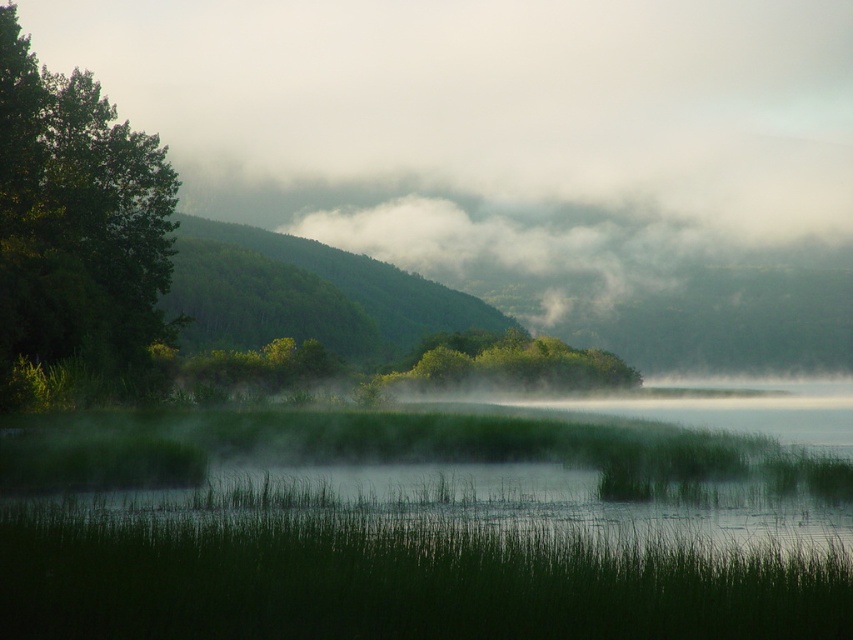
You are standing at the edge of the water in the serene landscape. If you want to reach the green grassy water at center, which direction should you move in relation to your current position?

The green grassy water at center is located at coordinates point (456, 470), so you should move towards the center of the image from your current position at the edge of the water.

You are an environmental scientist assessing the landscape. You need to determine which of the two objects, the green leafy tree at left or the green forested hill at center, covers a larger area in the image. Based on the scene description, which one is larger?

The green forested hill at center is larger than the green leafy tree at left because the green leafy tree at left occupies less space than green forested hill at center.

You are standing at the edge of the green grassy water at center and want to reach the green forested hill at center. Which direction should you move to get there?

The green grassy water at center is below the green forested hill at center, so you should move upward to reach the green forested hill at center.